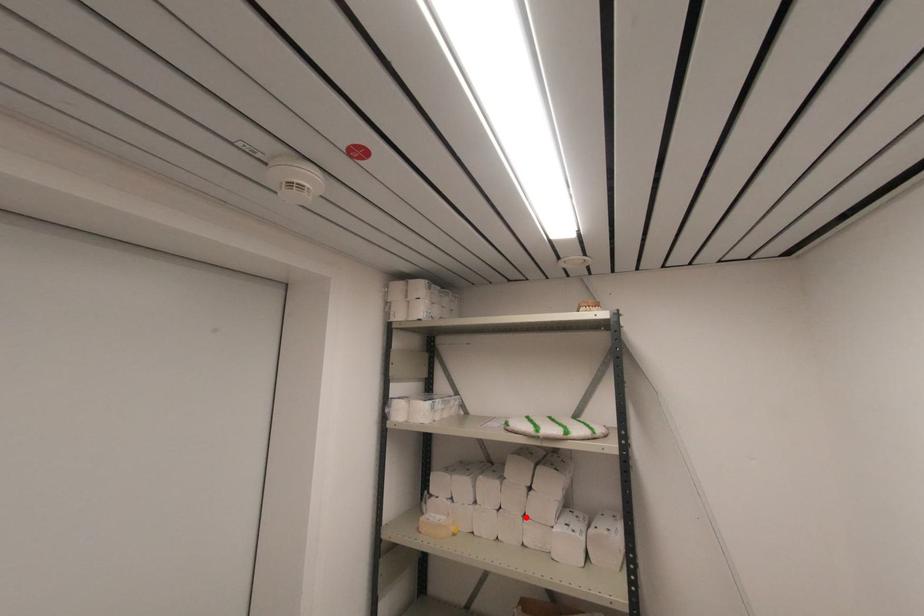
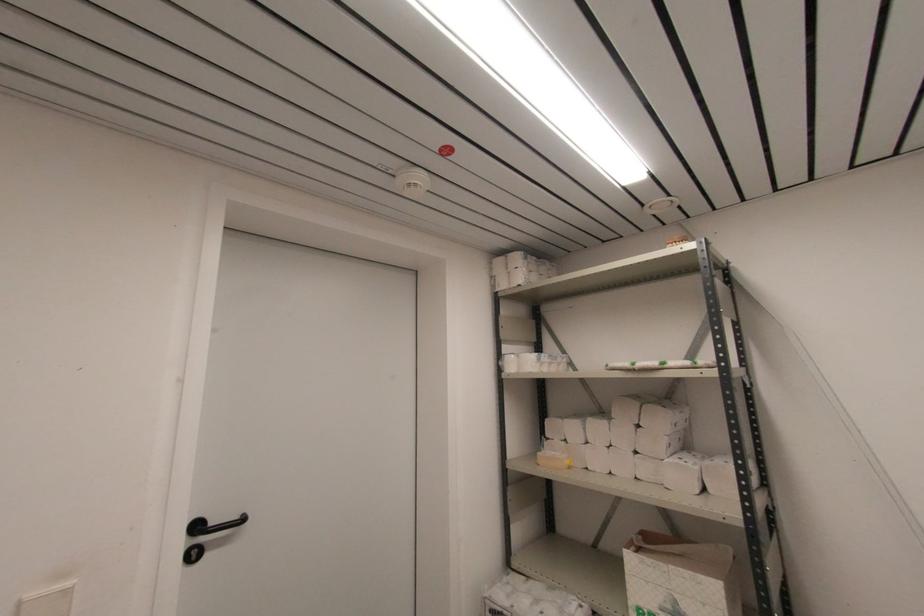
Find the pixel in the second image that matches the highlighted location in the first image.

(637, 453)